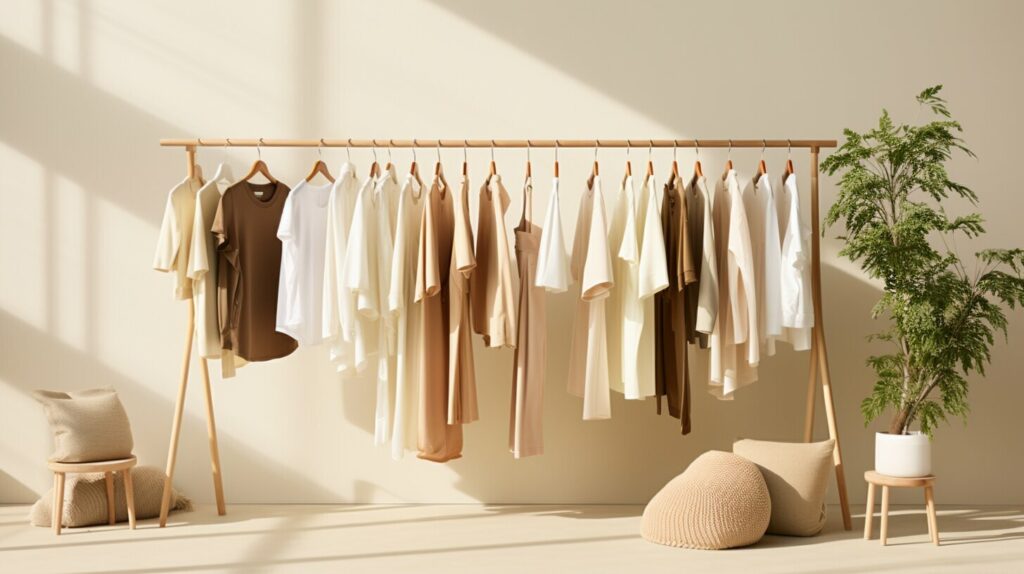
The height and width of the screenshot is (574, 1024). I want to click on wooden supports, so click(x=56, y=497), click(x=108, y=490), click(x=126, y=488), click(x=169, y=472), click(x=217, y=467), click(x=831, y=420), click(x=809, y=421), click(x=867, y=510), click(x=883, y=515), click(x=934, y=515).